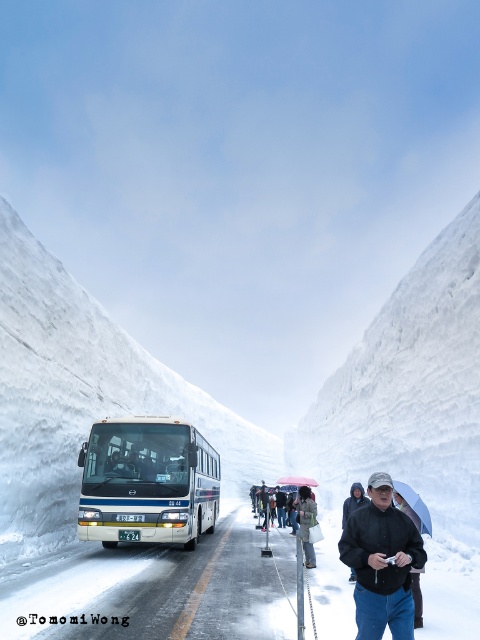
Question: Which point is farther to the camera?

Choices:
 (A) (183, 506)
 (B) (415, 545)
 (C) (420, 504)
 (D) (297, 522)

Answer: (D)

Question: Among these objects, which one is farthest from the camera?

Choices:
 (A) white glossy bus at center
 (B) denim jacket at lower center
 (C) black matte jacket at lower right
 (D) pink fabric umbrella at lower center

Answer: (D)

Question: Which point is farther to the camera?

Choices:
 (A) (405, 484)
 (B) (154, 448)

Answer: (B)

Question: Can you confirm if transparent plastic umbrella at lower center is smaller than dark gray jacket at center?

Choices:
 (A) yes
 (B) no

Answer: (A)

Question: Is white glossy bus at center below denim jacket at lower center?

Choices:
 (A) no
 (B) yes

Answer: (A)

Question: Is denim jacket at lower center to the right of transparent plastic umbrella at lower center from the viewer's perspective?

Choices:
 (A) no
 (B) yes

Answer: (A)